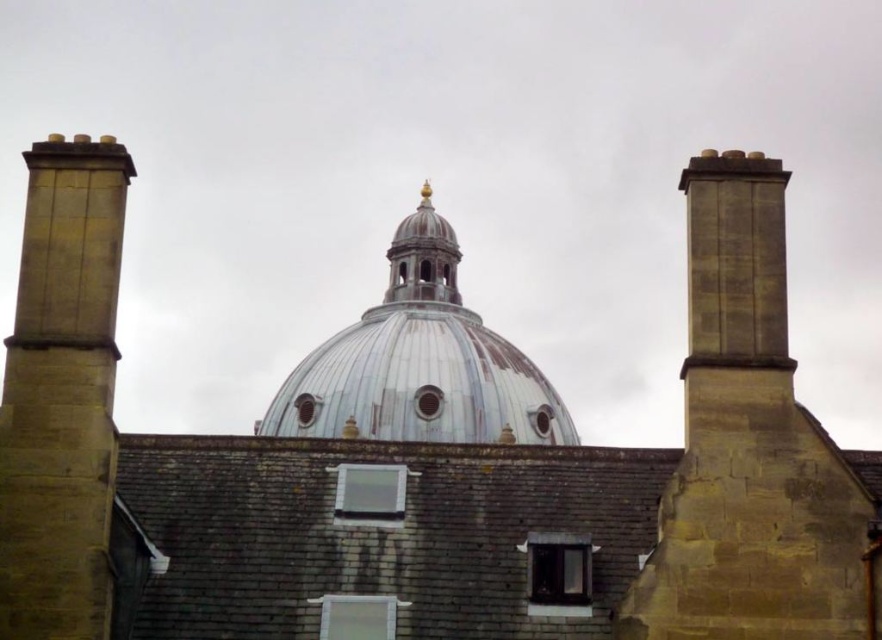
Is brown stone chimney at left shorter than metallic silver dome at center?

Indeed, brown stone chimney at left has a lesser height compared to metallic silver dome at center.

Who is lower down, brown stone chimney at left or metallic silver dome at center?

metallic silver dome at center is lower down.

Image resolution: width=882 pixels, height=640 pixels. Describe the element at coordinates (62, 394) in the screenshot. I see `brown stone chimney at left` at that location.

You are a GUI agent. You are given a task and a screenshot of the screen. Output one action in this format:
    pyautogui.click(x=<x>, y=<y>)
    Task: Click on the brown stone chimney at left
    This screenshot has width=882, height=640.
    Given the screenshot: What is the action you would take?
    pyautogui.click(x=62, y=394)